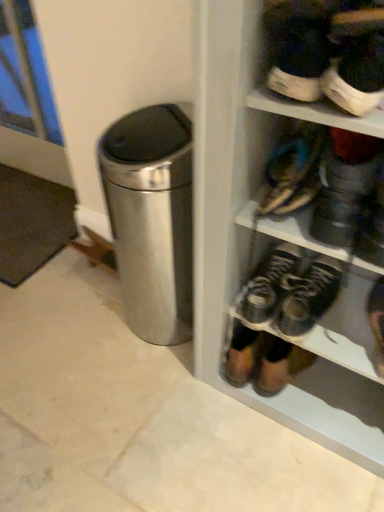
Question: Considering the relative sizes of leather sandals at upper right, which ranks as the third footwear in bottom-to-top order, and white rubber sneaker at upper right, which ranks as the 4th footwear in bottom-to-top order, in the image provided, is leather sandals at upper right, which ranks as the third footwear in bottom-to-top order, thinner than white rubber sneaker at upper right, which ranks as the 4th footwear in bottom-to-top order,?

Choices:
 (A) yes
 (B) no

Answer: (B)

Question: Is leather sandals at upper right, which ranks as the third footwear in bottom-to-top order, positioned with its back to white rubber sneaker at upper right, arranged as the 1th footwear when viewed from the top?

Choices:
 (A) no
 (B) yes

Answer: (A)

Question: Does leather sandals at upper right, which appears as the second footwear when viewed from the top, lie behind white rubber sneaker at upper right, which ranks as the 4th footwear in bottom-to-top order?

Choices:
 (A) yes
 (B) no

Answer: (A)

Question: Is leather sandals at upper right, which appears as the second footwear when viewed from the top, beside white rubber sneaker at upper right, arranged as the 1th footwear when viewed from the top?

Choices:
 (A) yes
 (B) no

Answer: (B)

Question: From the image's perspective, would you say leather sandals at upper right, which appears as the second footwear when viewed from the top, is shown under white rubber sneaker at upper right, which ranks as the 4th footwear in bottom-to-top order?

Choices:
 (A) yes
 (B) no

Answer: (A)

Question: From a real-world perspective, does leather sandals at upper right, which appears as the second footwear when viewed from the top, sit lower than white rubber sneaker at upper right, arranged as the 1th footwear when viewed from the top?

Choices:
 (A) no
 (B) yes

Answer: (B)

Question: Considering the relative positions of leather sandals at upper right, which ranks as the third footwear in bottom-to-top order, and dark brown leather shoes at center, the 2th footwear from the bottom, in the image provided, is leather sandals at upper right, which ranks as the third footwear in bottom-to-top order, to the right of dark brown leather shoes at center, the 2th footwear from the bottom, from the viewer's perspective?

Choices:
 (A) no
 (B) yes

Answer: (B)

Question: Does leather sandals at upper right, which appears as the second footwear when viewed from the top, come behind dark brown leather shoes at center, which is the third footwear from top to bottom?

Choices:
 (A) no
 (B) yes

Answer: (A)

Question: Is leather sandals at upper right, which appears as the second footwear when viewed from the top, taller than dark brown leather shoes at center, which is the third footwear from top to bottom?

Choices:
 (A) yes
 (B) no

Answer: (B)

Question: Is leather sandals at upper right, which appears as the second footwear when viewed from the top, oriented towards dark brown leather shoes at center, the 2th footwear from the bottom?

Choices:
 (A) no
 (B) yes

Answer: (A)

Question: Does leather sandals at upper right, which appears as the second footwear when viewed from the top, come in front of dark brown leather shoes at center, which is the third footwear from top to bottom?

Choices:
 (A) yes
 (B) no

Answer: (A)

Question: Does leather sandals at upper right, which appears as the second footwear when viewed from the top, have a smaller size compared to dark brown leather shoes at center, the 2th footwear from the bottom?

Choices:
 (A) no
 (B) yes

Answer: (B)

Question: Is the position of leather sandals at upper right, which ranks as the third footwear in bottom-to-top order, more distant than that of leather shoe at lower right, the fourth footwear positioned from the top?

Choices:
 (A) no
 (B) yes

Answer: (A)